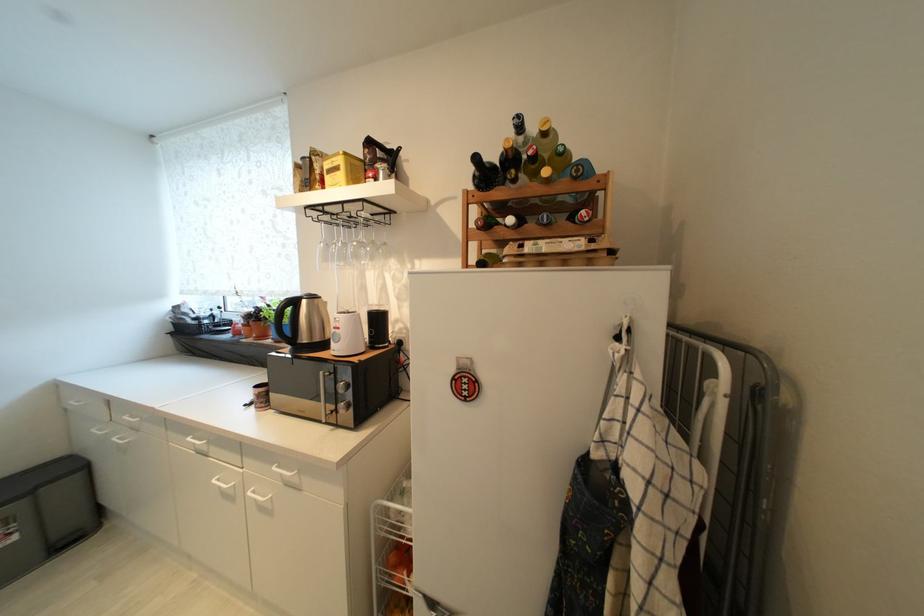
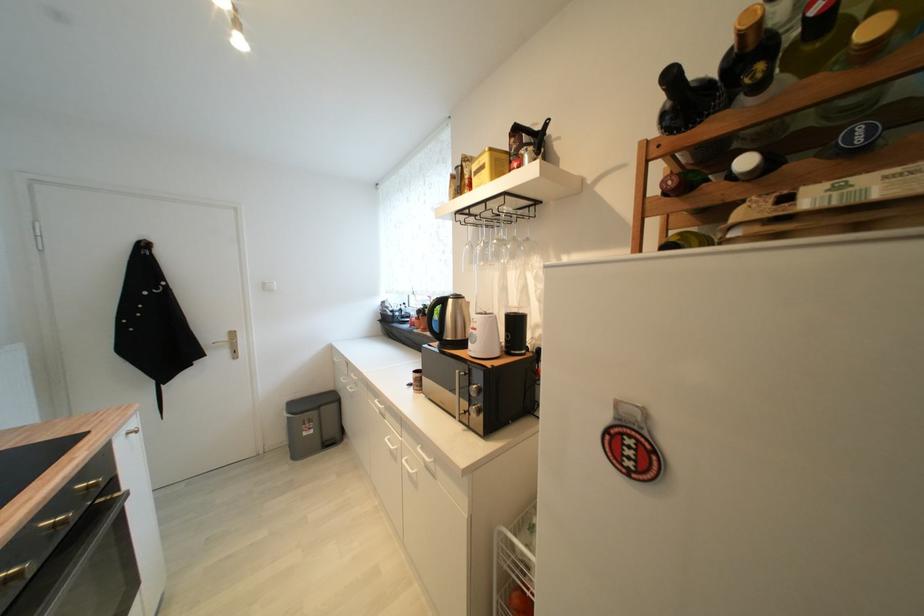
Where in the second image is the point corresponding to the point at 390,246 from the first image?

(532, 241)